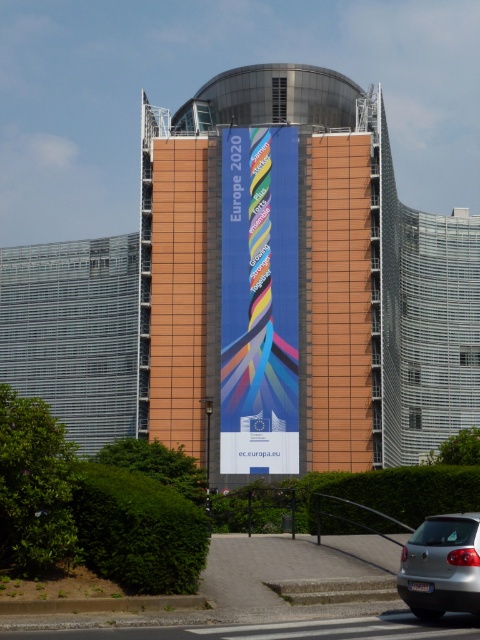
You are a photographer positioned at the blue fabric banner at center and want to capture the satin silver sedan at lower right in your shot. Given that your camera has a maximum zoom range of 100 meters, will you be able to photograph the sedan without moving?

The distance between the blue fabric banner at center and the satin silver sedan at lower right is 63.76 meters, which is within the camera maximum zoom range of 100 meters. Therefore, you can photograph the sedan without moving.